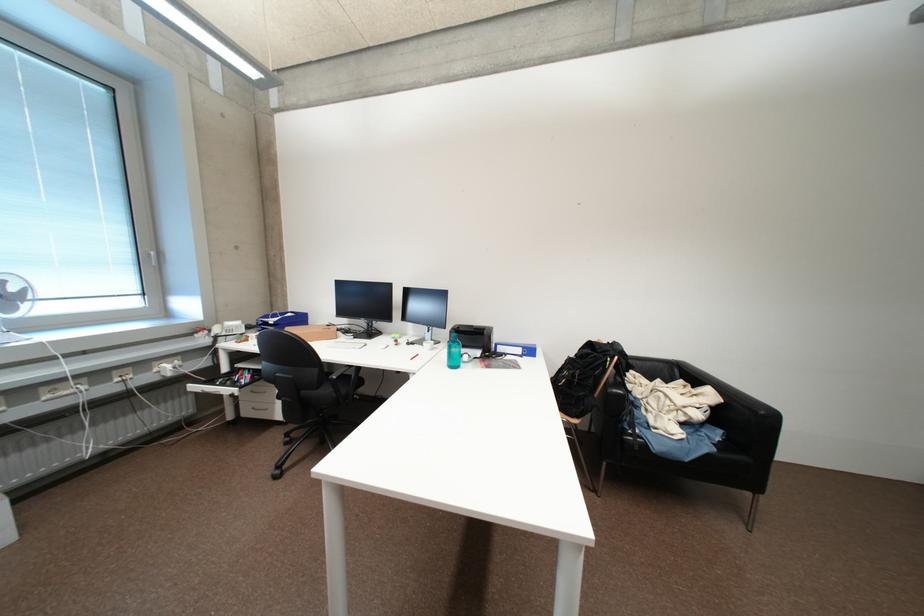
Locate an element on the screen. The height and width of the screenshot is (616, 924). chair armrest is located at coordinates (610, 411).